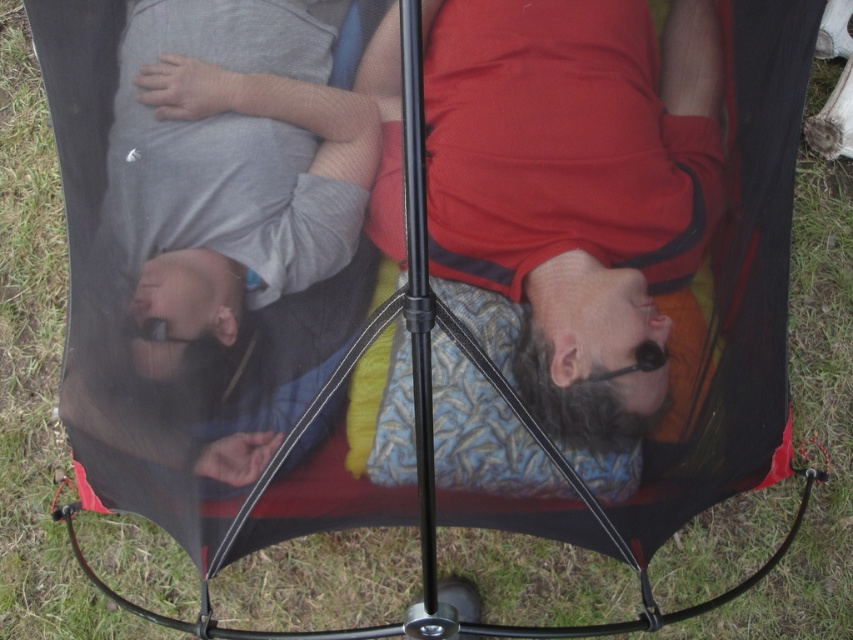
Question: Is matte red shirt at center wider than gray cotton shirt at upper left?

Choices:
 (A) no
 (B) yes

Answer: (B)

Question: Which object appears closest to the camera in this image?

Choices:
 (A) gray cotton shirt at upper left
 (B) matte red shirt at center

Answer: (B)

Question: Which object is closer to the camera taking this photo?

Choices:
 (A) matte red shirt at center
 (B) gray cotton shirt at upper left

Answer: (A)

Question: Observing the image, what is the correct spatial positioning of matte red shirt at center in reference to gray cotton shirt at upper left?

Choices:
 (A) below
 (B) above

Answer: (A)

Question: Does matte red shirt at center lie behind gray cotton shirt at upper left?

Choices:
 (A) yes
 (B) no

Answer: (B)

Question: Which point appears closest to the camera in this image?

Choices:
 (A) (688, 241)
 (B) (132, 67)

Answer: (A)